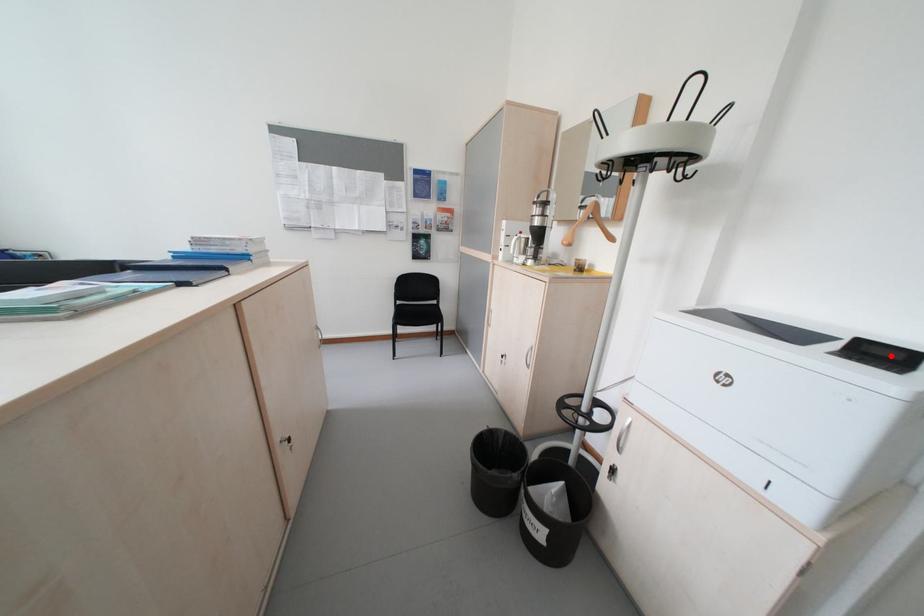
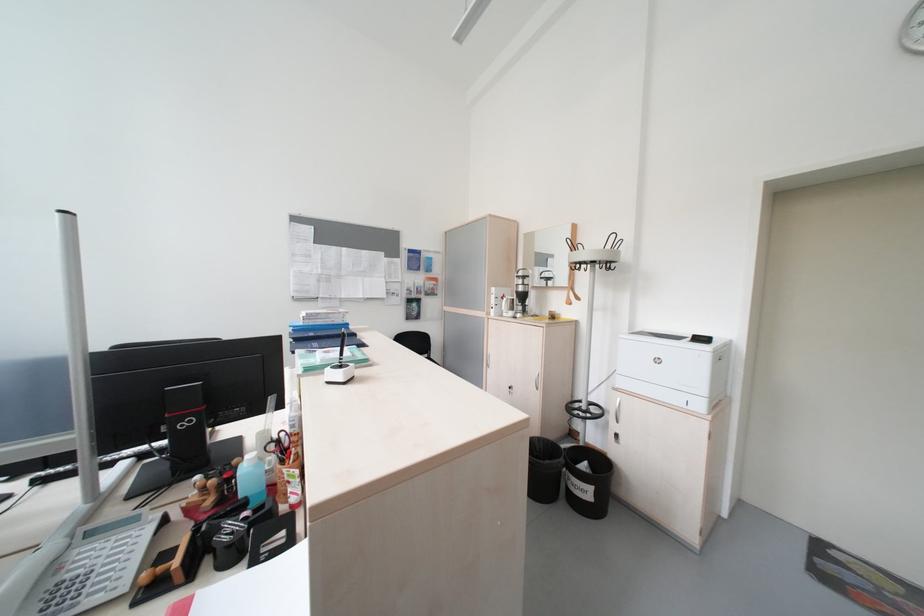
The point at the highlighted location is marked in the first image. Where is the corresponding point in the second image?

(711, 341)